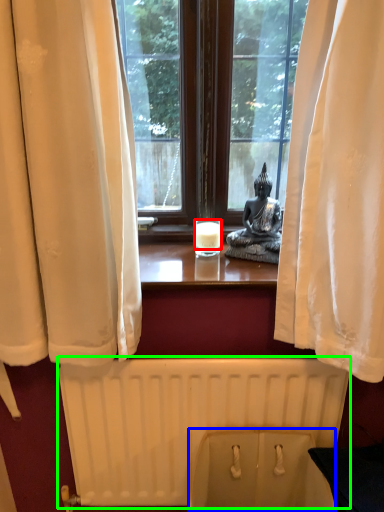
Question: Considering the real-world distances, which object is farthest from candle (highlighted by a red box)? toilet bowl (highlighted by a blue box) or radiator (highlighted by a green box)?

Choices:
 (A) toilet bowl
 (B) radiator

Answer: (A)